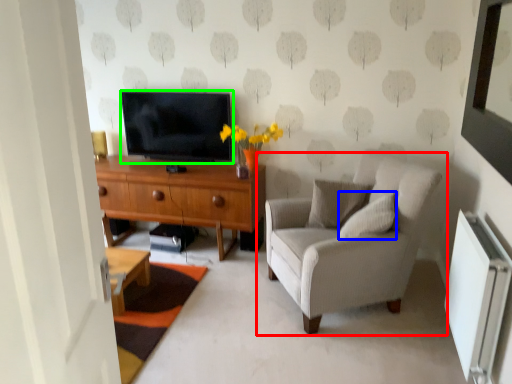
Question: Which object is positioned farthest from chair (highlighted by a red box)? Select from pillow (highlighted by a blue box) and television (highlighted by a green box).

Choices:
 (A) pillow
 (B) television

Answer: (B)